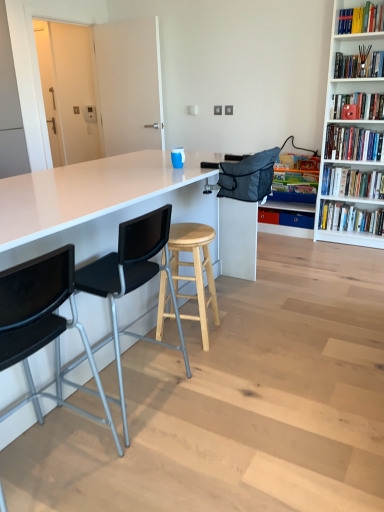
At what (x,y) coordinates should I click in order to perform the action: click on hardcover book at upper right, which ranks as the 7th book in bottom-to-top order. Please return your answer as a coordinate pair (x, y). The height and width of the screenshot is (512, 384). Looking at the image, I should click on (361, 19).

Describe the element at coordinates (361, 19) in the screenshot. The width and height of the screenshot is (384, 512). I see `hardcover book at upper right, which ranks as the 7th book in bottom-to-top order` at that location.

Where is `white glossy bookshelf at right, the seventh book when ordered from top to bottom`? This screenshot has height=512, width=384. white glossy bookshelf at right, the seventh book when ordered from top to bottom is located at coordinates (350, 218).

What do you see at coordinates (119, 208) in the screenshot?
I see `white glossy table at center` at bounding box center [119, 208].

Describe the element at coordinates (352, 183) in the screenshot. I see `white paperback book at upper right, placed as the 6th book when sorted from top to bottom` at that location.

The width and height of the screenshot is (384, 512). Describe the element at coordinates (330, 122) in the screenshot. I see `white wooden bookcase at upper right` at that location.

Image resolution: width=384 pixels, height=512 pixels. I want to click on black fabric bag at upper right, so click(290, 207).

Locate an element on the screen. The height and width of the screenshot is (512, 384). hardcover book at upper right, positioned as the 1th book in top-to-bottom order is located at coordinates (361, 19).

How many degrees apart are the facing directions of hardcover books at upper right, which is the fourth book from bottom to top, and hardcover book at upper right, positioned as the 1th book in top-to-bottom order?

hardcover books at upper right, which is the fourth book from bottom to top, and hardcover book at upper right, positioned as the 1th book in top-to-bottom order, are facing 1 degrees away from each other.

You are a GUI agent. You are given a task and a screenshot of the screen. Output one action in this format:
    pyautogui.click(x=<x>, y=<y>)
    Task: Click on the 3rd book positioned above the hardcover books at upper right, placed as the 4th book when sorted from top to bottom (from a real-world perspective)
    The image size is (384, 512).
    Given the screenshot: What is the action you would take?
    pyautogui.click(x=361, y=19)

Considering the sizes of hardcover books at upper right, which is the fourth book from bottom to top, and hardcover book at upper right, positioned as the 1th book in top-to-bottom order, in the image, is hardcover books at upper right, which is the fourth book from bottom to top, taller or shorter than hardcover book at upper right, positioned as the 1th book in top-to-bottom order,?

Clearly, hardcover books at upper right, which is the fourth book from bottom to top, is taller compared to hardcover book at upper right, positioned as the 1th book in top-to-bottom order.

This screenshot has width=384, height=512. Identify the location of stool below the wooden bookshelf at upper right, acting as the sixth book starting from the bottom (from the image's perspective). (195, 270).

Would you say wooden bookshelf at upper right, placed as the second book when sorted from top to bottom, is inside or outside natural wood stool at center?

wooden bookshelf at upper right, placed as the second book when sorted from top to bottom, is located beyond the bounds of natural wood stool at center.

Which is in front, point (362, 75) or point (180, 245)?

The point (180, 245) is more forward.

From a real-world perspective, is wooden bookshelf at upper right, placed as the second book when sorted from top to bottom, physically located above or below natural wood stool at center?

wooden bookshelf at upper right, placed as the second book when sorted from top to bottom, is situated higher than natural wood stool at center in the real world.

How much distance is there between hardcover book at center, the fifth book in the top-to-bottom sequence, and black plastic chair at left, the second chair positioned from the front?

hardcover book at center, the fifth book in the top-to-bottom sequence, and black plastic chair at left, the second chair positioned from the front, are 8.39 feet apart.

From the image's perspective, which one is positioned lower, hardcover book at center, the fifth book in the top-to-bottom sequence, or black plastic chair at left, marked as the first chair in a back-to-front arrangement?

black plastic chair at left, marked as the first chair in a back-to-front arrangement, appears lower in the image.

Is hardcover book at center, the third book from the bottom, bigger or smaller than black plastic chair at left, marked as the first chair in a back-to-front arrangement?

hardcover book at center, the third book from the bottom, is smaller than black plastic chair at left, marked as the first chair in a back-to-front arrangement.

Is hardcover book at center, the fifth book in the top-to-bottom sequence, taller or shorter than black plastic chair at left, marked as the first chair in a back-to-front arrangement?

Clearly, hardcover book at center, the fifth book in the top-to-bottom sequence, is shorter compared to black plastic chair at left, marked as the first chair in a back-to-front arrangement.

Considering the relative positions of matte red bookshelf at upper right, which is the 3th book from top to bottom, and white glossy bookshelf at right, the seventh book when ordered from top to bottom, in the image provided, is matte red bookshelf at upper right, which is the 3th book from top to bottom, to the right of white glossy bookshelf at right, the seventh book when ordered from top to bottom, from the viewer's perspective?

In fact, matte red bookshelf at upper right, which is the 3th book from top to bottom, is to the left of white glossy bookshelf at right, the seventh book when ordered from top to bottom.

In the scene shown: From a real-world perspective, is matte red bookshelf at upper right, which is the 3th book from top to bottom, under white glossy bookshelf at right, positioned as the 1th book in bottom-to-top order?

Actually, matte red bookshelf at upper right, which is the 3th book from top to bottom, is physically above white glossy bookshelf at right, positioned as the 1th book in bottom-to-top order, in the real world.

Would you say matte red bookshelf at upper right, which is the 3th book from top to bottom, contains white glossy bookshelf at right, positioned as the 1th book in bottom-to-top order?

Definitely not — white glossy bookshelf at right, positioned as the 1th book in bottom-to-top order, is not inside matte red bookshelf at upper right, which is the 3th book from top to bottom.

Is hardcover book at upper right, which ranks as the 7th book in bottom-to-top order, far away from black plastic chair at left, arranged as the second chair when viewed from the back?

hardcover book at upper right, which ranks as the 7th book in bottom-to-top order, is far away from black plastic chair at left, arranged as the second chair when viewed from the back.

There is a hardcover book at upper right, which ranks as the 7th book in bottom-to-top order. Identify the location of the 2nd chair below it (from the image's perspective). The height and width of the screenshot is (512, 384). (42, 323).

Can you confirm if hardcover book at upper right, which ranks as the 7th book in bottom-to-top order, is taller than black plastic chair at left, which is the first chair in front-to-back order?

No, hardcover book at upper right, which ranks as the 7th book in bottom-to-top order, is not taller than black plastic chair at left, which is the first chair in front-to-back order.

Considering the relative sizes of black fabric bag at upper right and natural wood stool at center in the image provided, is black fabric bag at upper right bigger than natural wood stool at center?

Indeed, black fabric bag at upper right has a larger size compared to natural wood stool at center.

Is point (292, 231) positioned behind point (159, 309)?

Yes, it is behind point (159, 309).

Is black fabric bag at upper right not near natural wood stool at center?

Absolutely, black fabric bag at upper right is distant from natural wood stool at center.

From a real-world perspective, between black fabric bag at upper right and natural wood stool at center, who is vertically higher?

From a 3D spatial view, black fabric bag at upper right is above.

Between blue plastic drawer at center and wooden bookshelf at upper right, placed as the second book when sorted from top to bottom, which one appears on the left side from the viewer's perspective?

From the viewer's perspective, blue plastic drawer at center appears more on the left side.

How different are the orientations of blue plastic drawer at center and wooden bookshelf at upper right, placed as the second book when sorted from top to bottom, in degrees?

They differ by 0.593 degrees in their facing directions.

From the image's perspective, is blue plastic drawer at center on wooden bookshelf at upper right, acting as the sixth book starting from the bottom?

Actually, blue plastic drawer at center appears below wooden bookshelf at upper right, acting as the sixth book starting from the bottom, in the image.

Who is more distant, blue plastic drawer at center or wooden bookshelf at upper right, placed as the second book when sorted from top to bottom?

blue plastic drawer at center is further away from the camera.

Identify the location of book that is the 3rd object directly below the hardcover book at upper right, which ranks as the 7th book in bottom-to-top order (from a real-world perspective). The width and height of the screenshot is (384, 512). (353, 143).

Starting from the natural wood stool at center, which book is the 2nd one behind? Please provide its 2D coordinates.

[(359, 65)]

Looking at the image, which one is located closer to white paperback book at upper right, placed as the 6th book when sorted from top to bottom, white glossy bookshelf at right, positioned as the 1th book in bottom-to-top order, or black plastic chair at left, the second chair positioned from the front?

The object closer to white paperback book at upper right, placed as the 6th book when sorted from top to bottom, is white glossy bookshelf at right, positioned as the 1th book in bottom-to-top order.

Based on their spatial positions, is white paperback book at upper right, placed as the 6th book when sorted from top to bottom, or wooden bookshelf at upper right, placed as the second book when sorted from top to bottom, further from hardcover book at upper right, positioned as the 1th book in top-to-bottom order?

The object further to hardcover book at upper right, positioned as the 1th book in top-to-bottom order, is white paperback book at upper right, placed as the 6th book when sorted from top to bottom.

Considering their positions, is black plastic chair at left, which is the first chair in front-to-back order, positioned closer to matte red bookshelf at upper right, the 5th book when ordered from bottom to top, than hardcover book at center, the third book from the bottom?

hardcover book at center, the third book from the bottom, is closer to matte red bookshelf at upper right, the 5th book when ordered from bottom to top.

When comparing their distances from natural wood stool at center, does hardcover book at center, the third book from the bottom, or blue plastic drawer at center seem closer?

hardcover book at center, the third book from the bottom, is closer to natural wood stool at center.

Based on their spatial positions, is natural wood stool at center or black plastic chair at left, marked as the first chair in a back-to-front arrangement, further from white paperback book at upper right, placed as the 6th book when sorted from top to bottom?

black plastic chair at left, marked as the first chair in a back-to-front arrangement, lies further to white paperback book at upper right, placed as the 6th book when sorted from top to bottom, than the other object.

Which object lies further to the anchor point black fabric bag at upper right, wooden bookshelf at upper right, placed as the second book when sorted from top to bottom, or blue plastic drawer at center?

Among the two, wooden bookshelf at upper right, placed as the second book when sorted from top to bottom, is located further to black fabric bag at upper right.

When comparing their distances from white glossy bookshelf at right, the seventh book when ordered from top to bottom, does matte red bookshelf at upper right, the 5th book when ordered from bottom to top, or black fabric bag at upper right seem closer?

Among the two, black fabric bag at upper right is located nearer to white glossy bookshelf at right, the seventh book when ordered from top to bottom.

Estimate the real-world distances between objects in this image. Which object is further from hardcover book at center, the third book from the bottom, white glossy bookshelf at right, positioned as the 1th book in bottom-to-top order, or white glossy table at center?

white glossy table at center is further to hardcover book at center, the third book from the bottom.

Where is `stool between white glossy table at center and white paperback book at upper right, placed as the 6th book when sorted from top to bottom, along the z-axis`? The height and width of the screenshot is (512, 384). stool between white glossy table at center and white paperback book at upper right, placed as the 6th book when sorted from top to bottom, along the z-axis is located at coordinates (195, 270).

Find the location of a particular element. Image resolution: width=384 pixels, height=512 pixels. chair between black plastic chair at left, arranged as the second chair when viewed from the back, and hardcover books at upper right, placed as the 4th book when sorted from top to bottom, in the front-back direction is located at coordinates (131, 280).

Identify the location of shelf between black plastic chair at left, which is the first chair in front-to-back order, and white glossy bookshelf at right, the seventh book when ordered from top to bottom, along the z-axis. (290, 207).

Where is `shelf positioned between black plastic chair at left, arranged as the second chair when viewed from the back, and blue plastic drawer at center from near to far`? The image size is (384, 512). shelf positioned between black plastic chair at left, arranged as the second chair when viewed from the back, and blue plastic drawer at center from near to far is located at coordinates (290, 207).